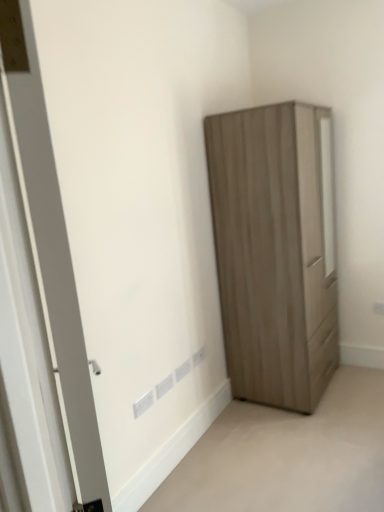
Question: Is white plastic electric outlet at lower center at the left side of white matte door at left?

Choices:
 (A) yes
 (B) no

Answer: (B)

Question: From the image's perspective, is white plastic electric outlet at lower center above white matte door at left?

Choices:
 (A) no
 (B) yes

Answer: (A)

Question: Is white plastic electric outlet at lower center turned away from white matte door at left?

Choices:
 (A) no
 (B) yes

Answer: (A)

Question: Considering the relative sizes of white plastic electric outlet at lower center and white matte door at left in the image provided, is white plastic electric outlet at lower center wider than white matte door at left?

Choices:
 (A) no
 (B) yes

Answer: (A)

Question: Could white matte door at left be considered to be inside white plastic electric outlet at lower center?

Choices:
 (A) no
 (B) yes

Answer: (A)

Question: Is matte wood wardrobe at right to the left or to the right of white plastic electric outlet at lower center in the image?

Choices:
 (A) left
 (B) right

Answer: (B)

Question: Relative to white plastic electric outlet at lower center, is matte wood wardrobe at right in front or behind?

Choices:
 (A) front
 (B) behind

Answer: (B)

Question: From their relative heights in the image, would you say matte wood wardrobe at right is taller or shorter than white plastic electric outlet at lower center?

Choices:
 (A) short
 (B) tall

Answer: (B)

Question: Considering the positions of point (332, 275) and point (142, 398), is point (332, 275) closer or farther from the camera than point (142, 398)?

Choices:
 (A) closer
 (B) farther

Answer: (B)

Question: Considering their positions, is matte wood wardrobe at right located in front of or behind matte wood wardrobe at lower right?

Choices:
 (A) behind
 (B) front

Answer: (A)

Question: In terms of width, does matte wood wardrobe at right look wider or thinner when compared to matte wood wardrobe at lower right?

Choices:
 (A) wide
 (B) thin

Answer: (B)

Question: Considering the relative positions of matte wood wardrobe at right and matte wood wardrobe at lower right in the image provided, is matte wood wardrobe at right to the left or to the right of matte wood wardrobe at lower right?

Choices:
 (A) right
 (B) left

Answer: (B)

Question: From a real-world perspective, is matte wood wardrobe at right physically located above or below matte wood wardrobe at lower right?

Choices:
 (A) above
 (B) below

Answer: (A)

Question: From the image's perspective, relative to white plastic electric outlet at lower center, is matte wood wardrobe at lower right above or below?

Choices:
 (A) above
 (B) below

Answer: (B)

Question: Considering the positions of matte wood wardrobe at lower right and white plastic electric outlet at lower center in the image, is matte wood wardrobe at lower right bigger or smaller than white plastic electric outlet at lower center?

Choices:
 (A) big
 (B) small

Answer: (A)